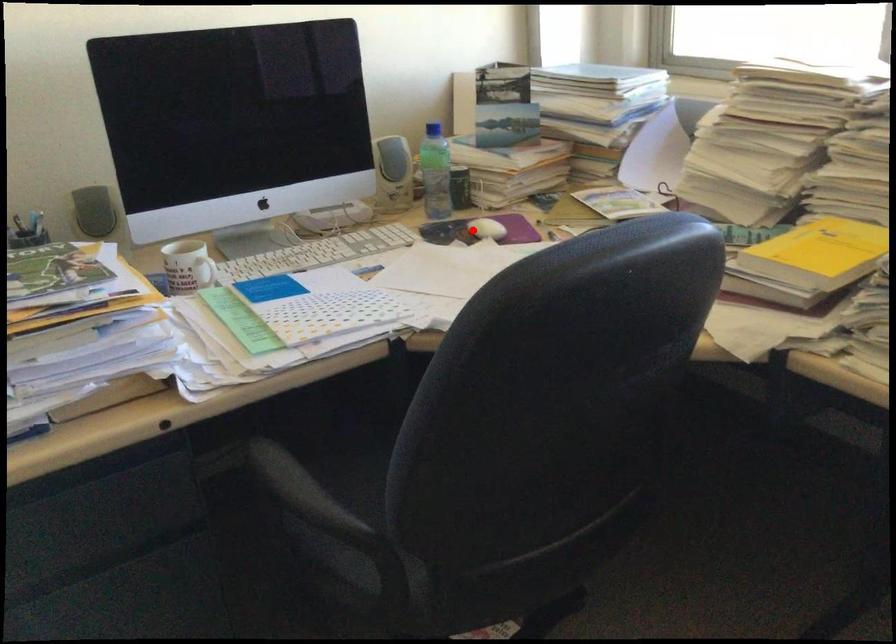
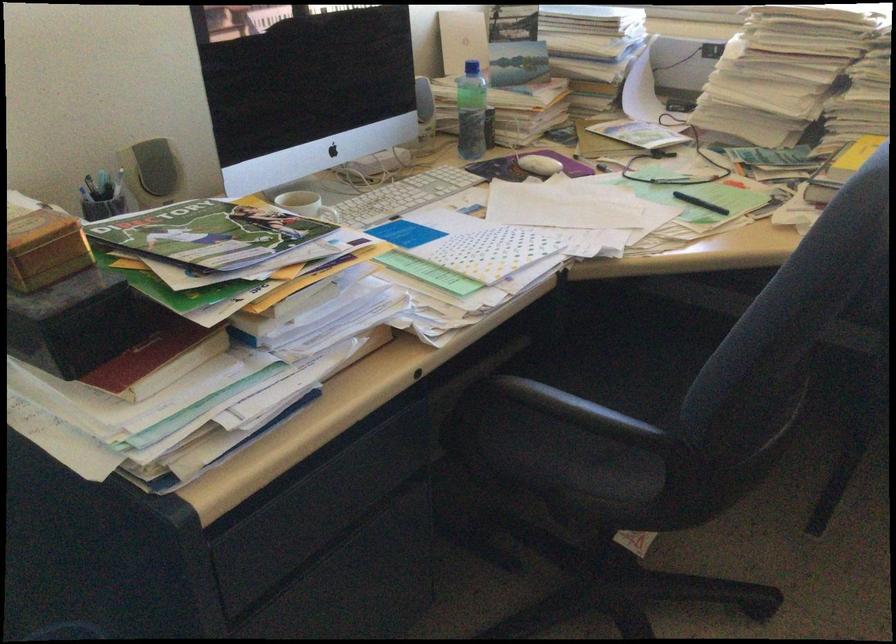
Locate, in the second image, the point that corresponds to the highlighted location in the first image.

(538, 165)